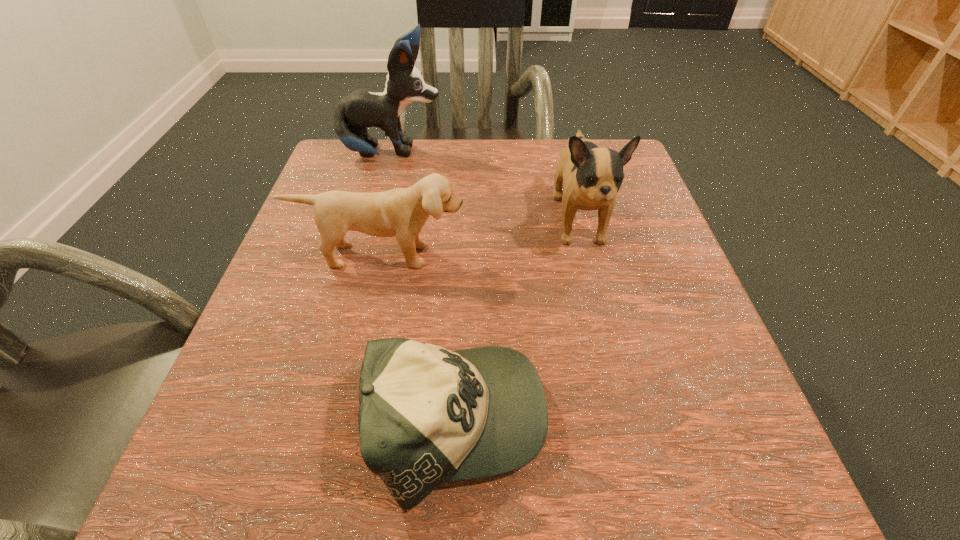
This screenshot has height=540, width=960. Identify the location of the closest puppy to the tallest object. (592, 175).

You are a GUI agent. You are given a task and a screenshot of the screen. Output one action in this format:
    pyautogui.click(x=<x>, y=<y>)
    Task: Click on the free space that satisfies the following two spatial constraints: 1. at the face of the rightmost puppy; 2. on the front-facing side of the shortest object
    This screenshot has height=540, width=960.
    Given the screenshot: What is the action you would take?
    pyautogui.click(x=628, y=422)

Where is `free space that satisfies the following two spatial constraints: 1. at the face of the second tallest object; 2. on the front-facing side of the baseball cap`? free space that satisfies the following two spatial constraints: 1. at the face of the second tallest object; 2. on the front-facing side of the baseball cap is located at coordinates (628, 422).